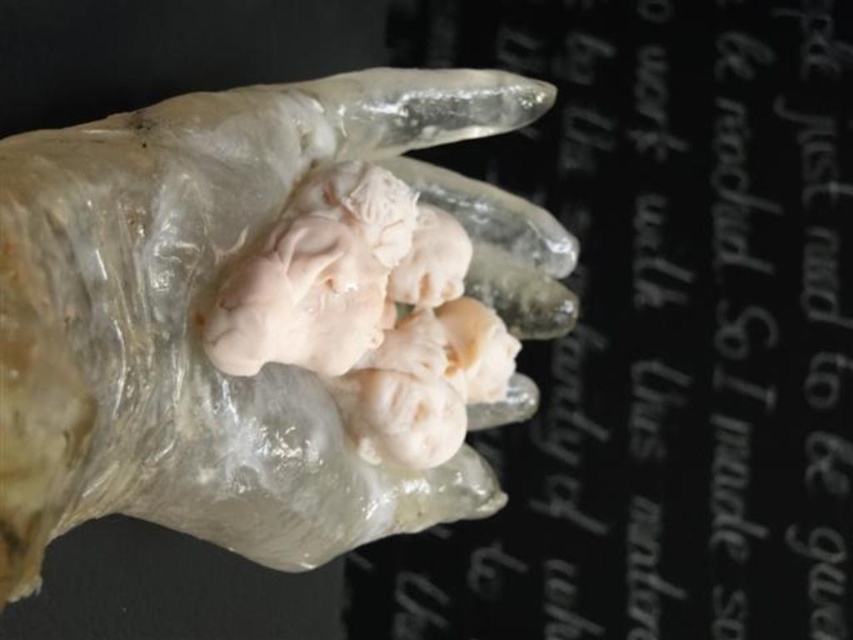
Does black glossy text at upper center have a greater width compared to translucent rubber hand at center?

Indeed, black glossy text at upper center has a greater width compared to translucent rubber hand at center.

Is point (660, 308) closer to camera compared to point (129, 216)?

That is False.

Locate an element on the screen. This screenshot has height=640, width=853. black glossy text at upper center is located at coordinates (657, 332).